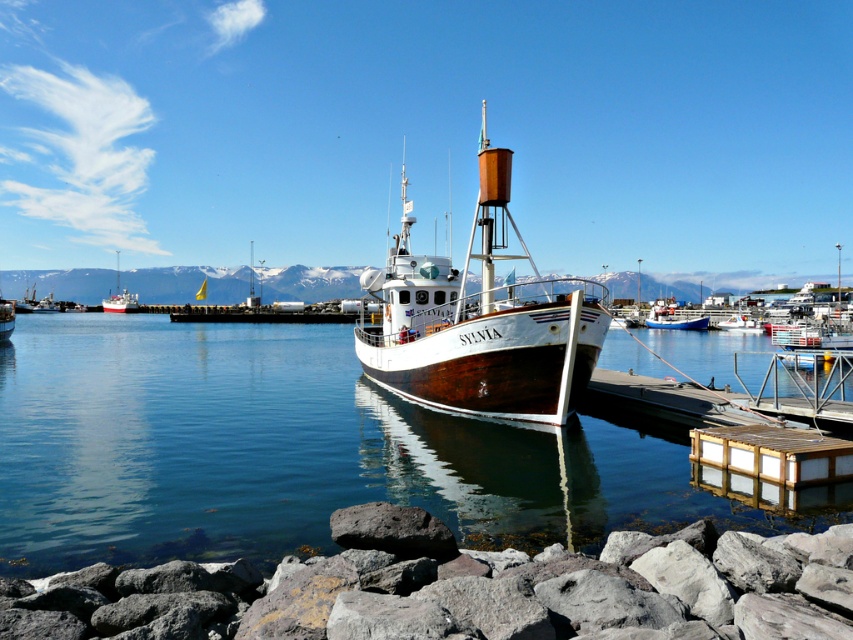
Question: Which point is closer to the camera?

Choices:
 (A) (360, 614)
 (B) (424, 273)
 (C) (654, 358)
 (D) (128, 300)

Answer: (A)

Question: Can you confirm if transparent water at center is bigger than white glossy boat at left?

Choices:
 (A) no
 (B) yes

Answer: (A)

Question: Can you confirm if transparent water at center is thinner than gray rock at lower left?

Choices:
 (A) no
 (B) yes

Answer: (A)

Question: Which object is the closest to the white glossy boat at left?

Choices:
 (A) gray rock at lower left
 (B) white wood boat at center
 (C) transparent water at center

Answer: (B)

Question: Is transparent water at center above white glossy boat at left?

Choices:
 (A) no
 (B) yes

Answer: (A)

Question: Which object is the closest to the gray rock at lower left?

Choices:
 (A) white wood boat at center
 (B) white glossy boat at left
 (C) transparent water at center

Answer: (C)